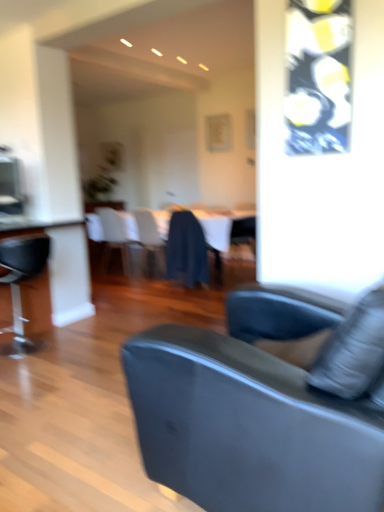
Question: Based on their sizes in the image, would you say translucent plastic chair at center, the 3th chair positioned from the back, is bigger or smaller than white fabric chair at center, the first chair in the back-to-front sequence?

Choices:
 (A) big
 (B) small

Answer: (B)

Question: Considering the positions of translucent plastic chair at center, the 3th chair positioned from the back, and white fabric chair at center, the first chair in the back-to-front sequence, in the image, is translucent plastic chair at center, the 3th chair positioned from the back, taller or shorter than white fabric chair at center, the first chair in the back-to-front sequence,?

Choices:
 (A) tall
 (B) short

Answer: (B)

Question: Which object is the closest to the translucent plastic chair at center, which appears as the 3th chair when viewed from the front?

Choices:
 (A) dark blue fabric at center, the fourth chair when ordered from back to front
 (B) white glossy table at center
 (C) white fabric chair at center, the first chair in the back-to-front sequence
 (D) matte blue chair at center, acting as the 4th chair starting from the front
 (E) suede-like gray couch at center

Answer: (C)

Question: Estimate the real-world distances between objects in this image. Which object is closer to the white fabric chair at center, the 5th chair in the front-to-back sequence?

Choices:
 (A) translucent plastic chair at center, the 3th chair positioned from the back
 (B) black leather chair at left, acting as the fifth chair starting from the back
 (C) matte blue chair at center, the 2th chair from the back
 (D) suede-like gray couch at center
 (E) dark blue fabric at center, the 2th chair from the front

Answer: (A)